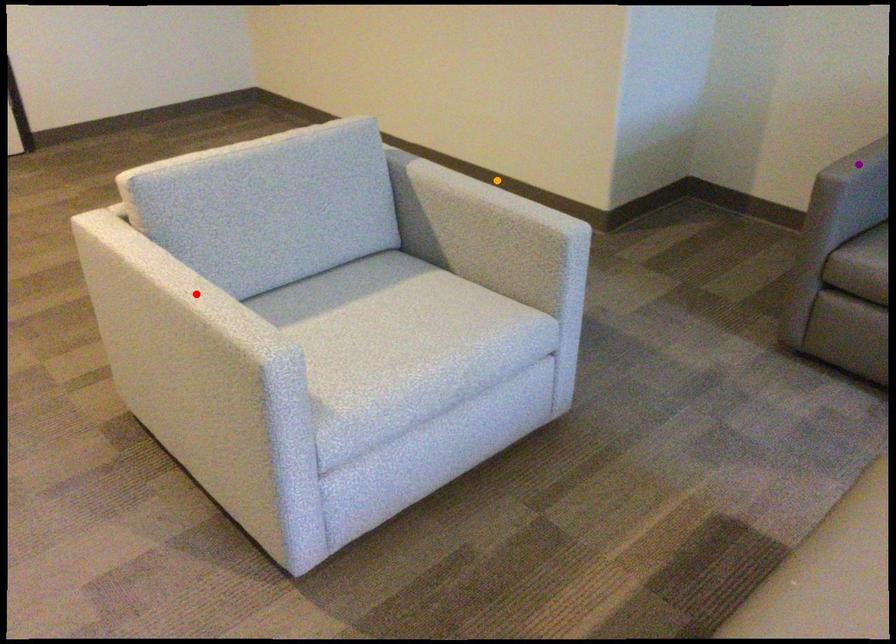
Order these from nearest to farthest:
purple point, red point, orange point

red point
purple point
orange point